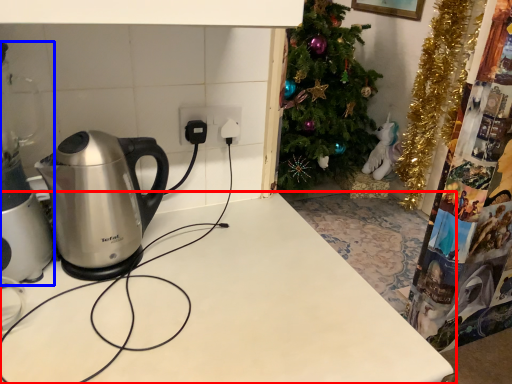
Question: Among these objects, which one is nearest to the camera, table (highlighted by a red box) or appliance (highlighted by a blue box)?

Choices:
 (A) table
 (B) appliance

Answer: (A)